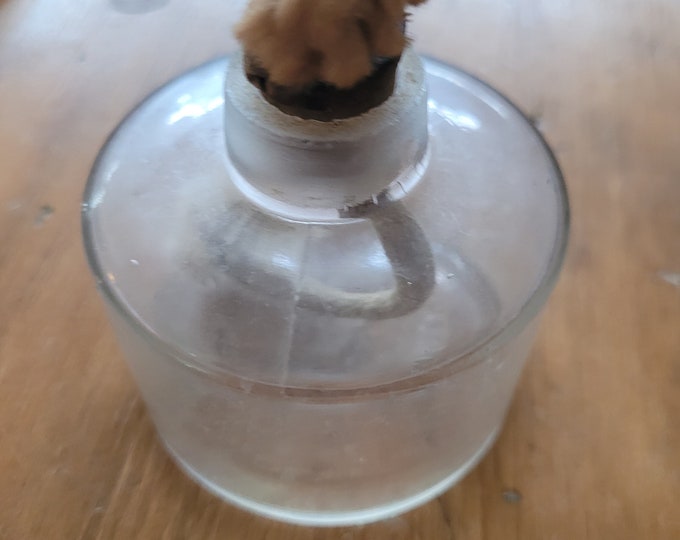
The image size is (680, 540). Find the location of `jug`. jug is located at coordinates [x=394, y=348].